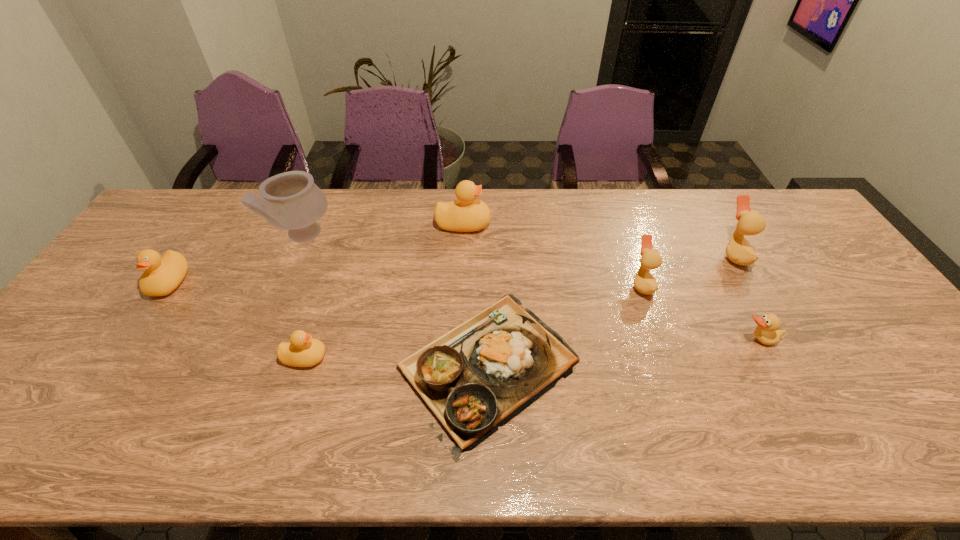
The width and height of the screenshot is (960, 540). I want to click on free space at the near edge of the desktop, so click(x=778, y=448).

Image resolution: width=960 pixels, height=540 pixels. In order to click on vacant area at the right edge in this screenshot , I will do `click(873, 352)`.

In the image, there is a desktop. Find the location of `free space at the far left corner`. free space at the far left corner is located at coordinates (184, 211).

At what (x,y) coordinates should I click in order to perform the action: click on vacant area that lies between the leftmost object and the rightmost yellow duck. Please return your answer as a coordinate pair (x, y). The height and width of the screenshot is (540, 960). Looking at the image, I should click on (316, 253).

Find the location of `free space that is in between the second smallest tan duck and the smallest tan duck`. free space that is in between the second smallest tan duck and the smallest tan duck is located at coordinates pos(700,312).

You are a GUI agent. You are given a task and a screenshot of the screen. Output one action in this format:
    pyautogui.click(x=<x>, y=<y>)
    Task: Click on the free space between the farthest yellow duck and the brown pottery
    
    Given the screenshot: What is the action you would take?
    pyautogui.click(x=383, y=230)

At what (x,y) coordinates should I click in order to perform the action: click on free space between the brown pottery and the second smallest tan duck. Please return your answer as a coordinate pair (x, y). This screenshot has width=960, height=540. Looking at the image, I should click on (472, 260).

Where is `free space between the smallest tan duck and the rightmost yellow duck`? free space between the smallest tan duck and the rightmost yellow duck is located at coordinates (611, 282).

Where is `free spot between the brown pottery and the second biggest tan duck`? The image size is (960, 540). free spot between the brown pottery and the second biggest tan duck is located at coordinates (472, 260).

You are a GUI agent. You are given a task and a screenshot of the screen. Output one action in this format:
    pyautogui.click(x=<x>, y=<y>)
    Task: Click on the vacant space that is in between the shortest object and the smallest tan duck
    
    Given the screenshot: What is the action you would take?
    [x=622, y=353]